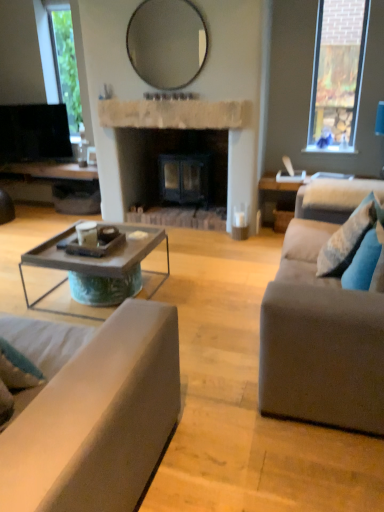
Find the location of a particular element. The height and width of the screenshot is (512, 384). free location to the right of rustic wood coffee table at center is located at coordinates (208, 298).